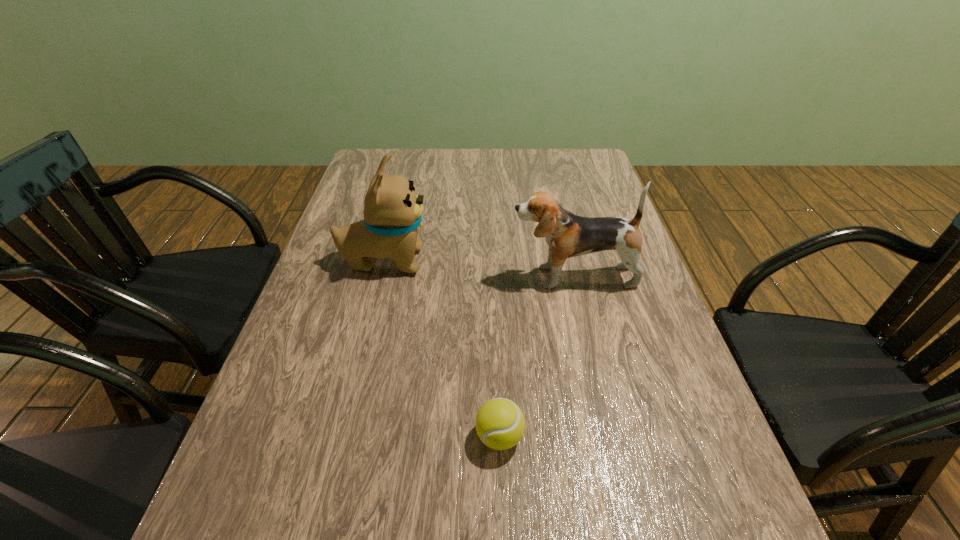
What are the coordinates of `vacant space in between the left puppy and the right puppy` in the screenshot? It's located at (479, 269).

Where is `empty location between the leftmost object and the shortest object`? empty location between the leftmost object and the shortest object is located at coordinates (442, 348).

Where is `empty space that is in between the right puppy and the nearest object`? This screenshot has width=960, height=540. empty space that is in between the right puppy and the nearest object is located at coordinates (537, 356).

You are a GUI agent. You are given a task and a screenshot of the screen. Output one action in this format:
    pyautogui.click(x=<x>, y=<y>)
    Task: Click on the vacant space in between the shortest object and the leftmost object
    
    Given the screenshot: What is the action you would take?
    pyautogui.click(x=442, y=348)

At what (x,y) coordinates should I click in order to perform the action: click on free space between the nearest object and the right puppy. Please return your answer as a coordinate pair (x, y). This screenshot has width=960, height=540. Looking at the image, I should click on (537, 356).

Locate an element on the screen. The height and width of the screenshot is (540, 960). unoccupied position between the left puppy and the right puppy is located at coordinates (479, 269).

Identify the location of object that is the second nearest to the left puppy. (500, 424).

Where is `the closest object to the shortest object`? This screenshot has width=960, height=540. the closest object to the shortest object is located at coordinates (568, 235).

At what (x,y) coordinates should I click in order to perform the action: click on free spot that satisfies the following two spatial constraints: 1. on the face of the shortest object; 2. on the left side of the leftmost object. Please return your answer as a coordinate pair (x, y). Image resolution: width=960 pixels, height=540 pixels. Looking at the image, I should click on tap(340, 436).

Locate an element on the screen. Image resolution: width=960 pixels, height=540 pixels. vacant area in the image that satisfies the following two spatial constraints: 1. at the face of the right puppy; 2. on the front side of the shortest object is located at coordinates (611, 436).